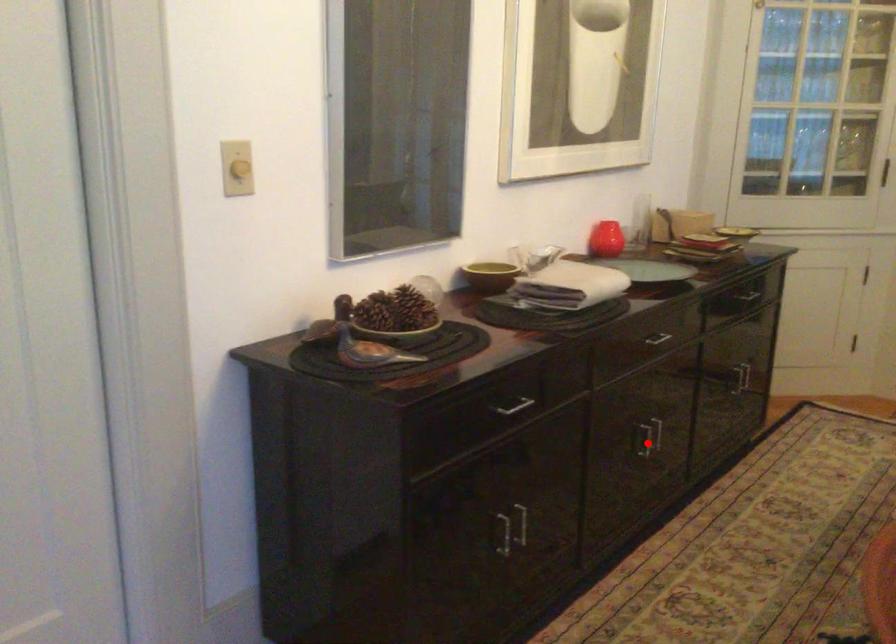
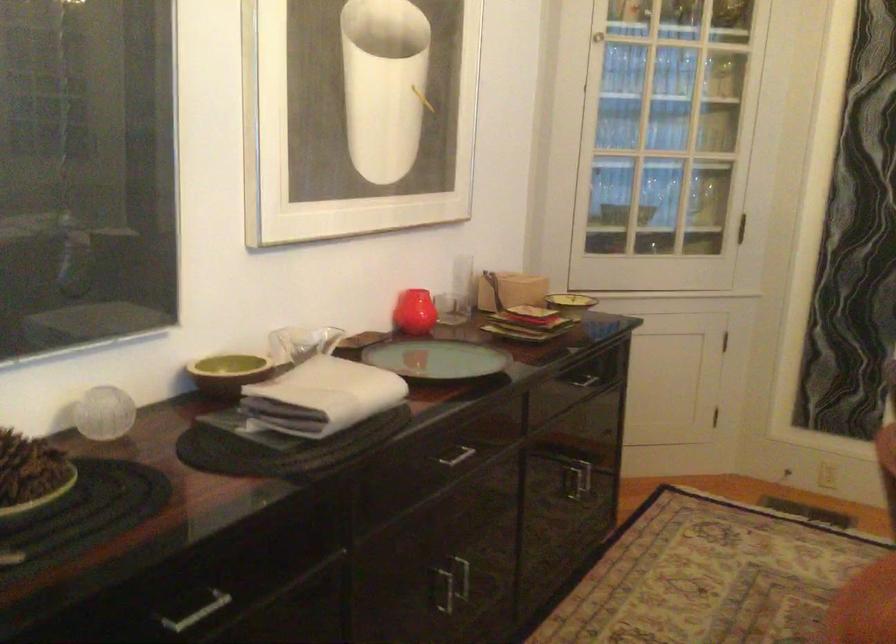
Question: I am providing you with two images of the same scene from different viewpoints. In image1, a red point is highlighted. Considering the same 3D point in image2, which of the following is correct?

Choices:
 (A) It is closer
 (B) It is farther

Answer: (A)